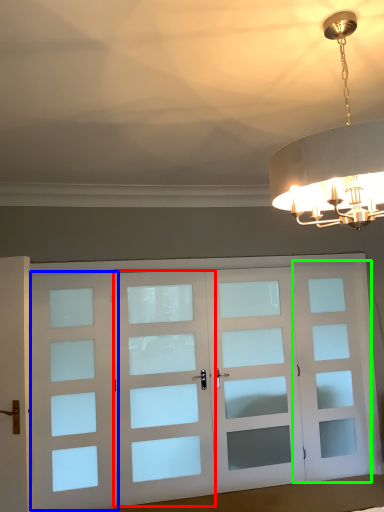
Question: Which object is positioned farthest from screen door (highlighted by a red box)? Select from screen door (highlighted by a blue box) and screen door (highlighted by a green box).

Choices:
 (A) screen door
 (B) screen door

Answer: (B)